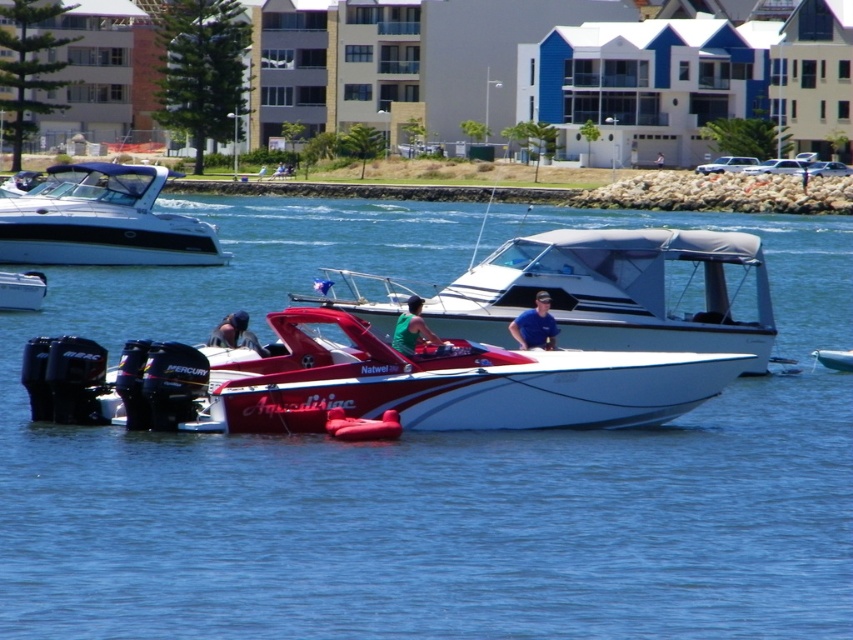
Between white glossy motorboat at upper left and blue fabric shirt at center, which one appears on the left side from the viewer's perspective?

From the viewer's perspective, white glossy motorboat at upper left appears more on the left side.

Where is `white glossy motorboat at upper left`? Image resolution: width=853 pixels, height=640 pixels. white glossy motorboat at upper left is located at coordinates (102, 220).

What do you see at coordinates (102, 220) in the screenshot?
I see `white glossy motorboat at upper left` at bounding box center [102, 220].

This screenshot has height=640, width=853. Find the location of `white glossy motorboat at upper left`. white glossy motorboat at upper left is located at coordinates point(102,220).

Does shiny white motorboat at center have a lesser width compared to green matte shirt at center?

No.

This screenshot has width=853, height=640. What are the coordinates of `shiny white motorboat at center` in the screenshot? It's located at (619, 291).

The height and width of the screenshot is (640, 853). What do you see at coordinates (428, 468) in the screenshot?
I see `white glossy water at center` at bounding box center [428, 468].

Who is higher up, white glossy water at center or white glossy dinghy at lower right?

Positioned higher is white glossy water at center.

Which is in front, point (833, 435) or point (838, 349)?

Point (833, 435) is in front.

Where is `white glossy water at center`? Image resolution: width=853 pixels, height=640 pixels. white glossy water at center is located at coordinates (428, 468).